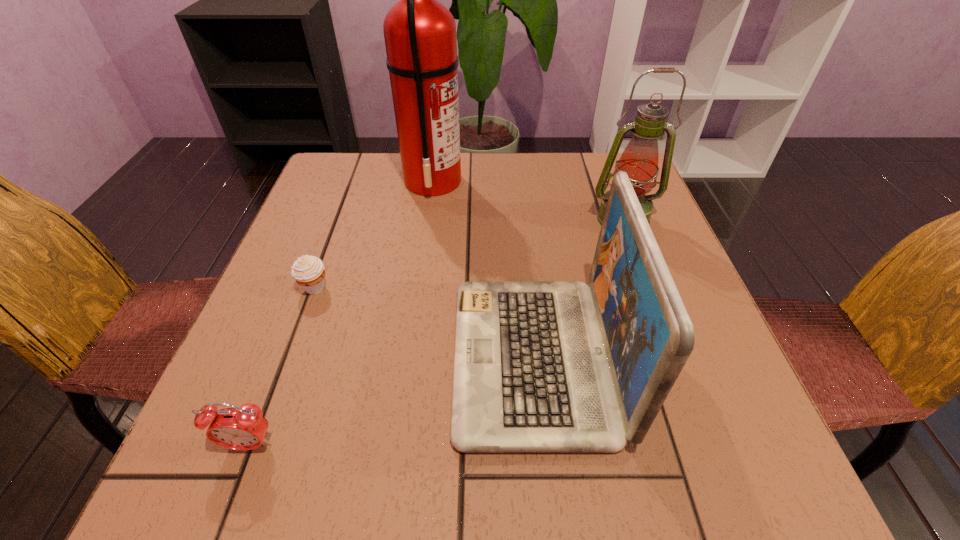
Identify the location of fire extinguisher. The image size is (960, 540). (420, 38).

Locate an element on the screen. Image resolution: width=960 pixels, height=540 pixels. the third object from right to left is located at coordinates (420, 38).

Image resolution: width=960 pixels, height=540 pixels. What are the coordinates of `the second tallest object` in the screenshot? It's located at (639, 160).

At what (x,y) coordinates should I click in order to perform the action: click on the rightmost object. Please return your answer as a coordinate pair (x, y). This screenshot has width=960, height=540. Looking at the image, I should click on (639, 160).

The height and width of the screenshot is (540, 960). What are the coordinates of `the third shortest object` in the screenshot? It's located at (539, 366).

Find the location of a particular element. This screenshot has width=960, height=540. laptop computer is located at coordinates (539, 366).

Find the location of a particular element. This screenshot has width=960, height=540. alarm clock is located at coordinates (244, 428).

The image size is (960, 540). Find the location of `the shortest object`. the shortest object is located at coordinates (308, 271).

Locate an element on the screen. blank space located 0.060m at the nozzle of the third object from right to left is located at coordinates (486, 181).

At what (x,y) coordinates should I click in order to perform the action: click on vacant space located on the front of the rightmost object. Please return your answer as a coordinate pair (x, y). This screenshot has width=960, height=540. Looking at the image, I should click on (659, 316).